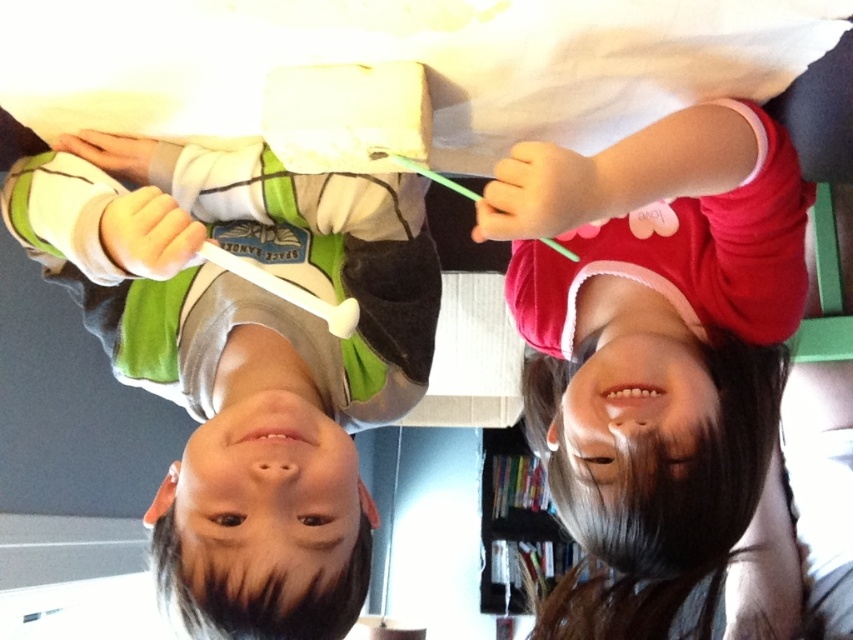
Does matte green and white shirt at left have a lesser height compared to matte pink hoodie at upper right?

Incorrect, matte green and white shirt at left's height does not fall short of matte pink hoodie at upper right's.

This screenshot has height=640, width=853. Describe the element at coordinates (245, 355) in the screenshot. I see `matte green and white shirt at left` at that location.

Locate an element on the screen. The width and height of the screenshot is (853, 640). matte green and white shirt at left is located at coordinates (245, 355).